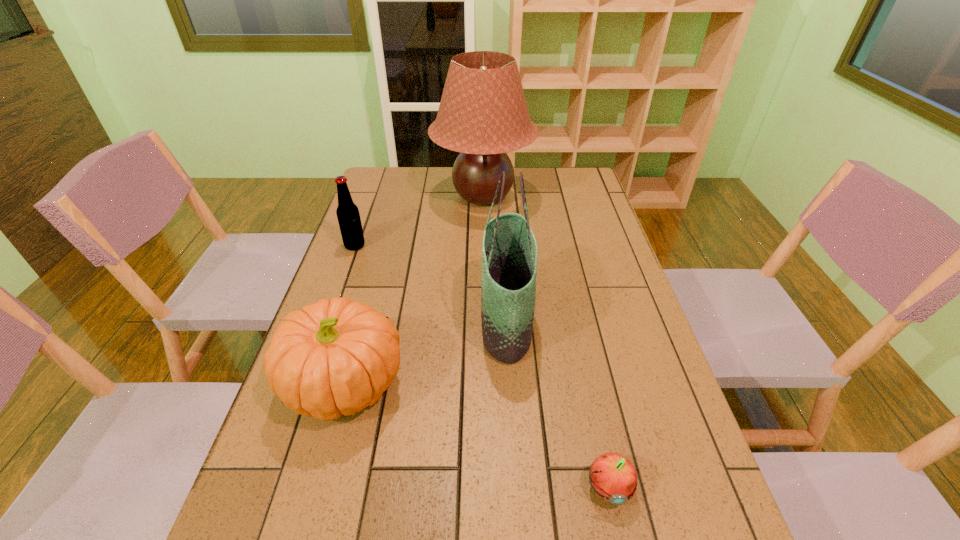
I want to click on the farthest object, so click(x=483, y=114).

At what (x,y) coordinates should I click in order to perform the action: click on tote bag. Please return your answer as a coordinate pair (x, y). This screenshot has width=960, height=540. Looking at the image, I should click on (509, 250).

Locate an element on the screen. Image resolution: width=960 pixels, height=540 pixels. the second farthest object is located at coordinates (348, 216).

I want to click on pumpkin, so pyautogui.click(x=337, y=356).

Identify the location of apple. The width and height of the screenshot is (960, 540). (613, 477).

The image size is (960, 540). I want to click on the nearest object, so click(613, 477).

You are a GUI agent. You are given a task and a screenshot of the screen. Output one action in this format:
    pyautogui.click(x=<x>, y=<y>)
    Task: Click on the vacant region located 0.070m on the front-facing side of the lampshade
    Image resolution: width=960 pixels, height=540 pixels.
    Given the screenshot: What is the action you would take?
    pyautogui.click(x=414, y=197)

In order to click on vacant space situated on the front-facing side of the lampshade in this screenshot , I will do `click(386, 197)`.

This screenshot has width=960, height=540. In order to click on vacant area situated on the front-facing side of the lampshade in this screenshot , I will do `click(386, 197)`.

Image resolution: width=960 pixels, height=540 pixels. Find the location of `free space located on the right of the tote bag`. free space located on the right of the tote bag is located at coordinates (619, 320).